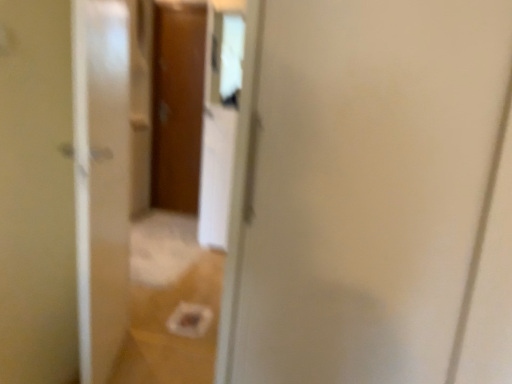
Question: Is wooden door at center not inside transparent glass screen door at left?

Choices:
 (A) no
 (B) yes

Answer: (B)

Question: Does wooden door at center have a greater height compared to transparent glass screen door at left?

Choices:
 (A) no
 (B) yes

Answer: (B)

Question: Is wooden door at center smaller than transparent glass screen door at left?

Choices:
 (A) yes
 (B) no

Answer: (A)

Question: From a real-world perspective, is wooden door at center over transparent glass screen door at left?

Choices:
 (A) yes
 (B) no

Answer: (A)

Question: Is there a large distance between wooden door at center and transparent glass screen door at left?

Choices:
 (A) no
 (B) yes

Answer: (B)

Question: In terms of height, does wooden door at center look taller or shorter compared to transparent glass door at center?

Choices:
 (A) tall
 (B) short

Answer: (A)

Question: Is wooden door at center inside the boundaries of transparent glass door at center, or outside?

Choices:
 (A) inside
 (B) outside

Answer: (B)

Question: From a real-world perspective, is wooden door at center above or below transparent glass door at center?

Choices:
 (A) above
 (B) below

Answer: (A)

Question: Is wooden door at center to the left or to the right of transparent glass door at center in the image?

Choices:
 (A) left
 (B) right

Answer: (A)

Question: Does point (120, 91) appear closer or farther from the camera than point (125, 182)?

Choices:
 (A) farther
 (B) closer

Answer: (B)

Question: Is transparent glass door at center situated inside transparent glass screen door at left or outside?

Choices:
 (A) inside
 (B) outside

Answer: (B)

Question: From the image's perspective, is transparent glass door at center positioned above or below transparent glass screen door at left?

Choices:
 (A) below
 (B) above

Answer: (B)

Question: Relative to transparent glass screen door at left, is transparent glass door at center in front or behind?

Choices:
 (A) behind
 (B) front

Answer: (A)

Question: Considering the relative positions of transparent glass screen door at left and wooden door at center in the image provided, is transparent glass screen door at left to the left or to the right of wooden door at center?

Choices:
 (A) right
 (B) left

Answer: (A)

Question: In terms of size, does transparent glass screen door at left appear bigger or smaller than wooden door at center?

Choices:
 (A) big
 (B) small

Answer: (A)